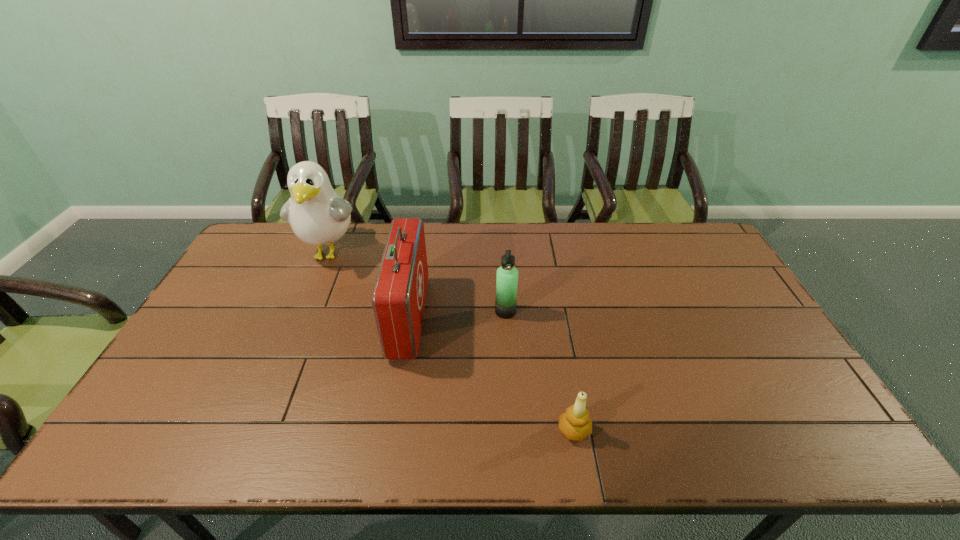
Identify the location of the tallest object. This screenshot has width=960, height=540. (318, 215).

This screenshot has width=960, height=540. Identify the location of gull. (318, 215).

Where is `the second object from left to right`? This screenshot has width=960, height=540. the second object from left to right is located at coordinates (398, 299).

Identify the location of the second tallest object. (398, 299).

The image size is (960, 540). Identify the location of the third tallest object. (507, 275).

This screenshot has height=540, width=960. Find the location of `thermos bottle`. thermos bottle is located at coordinates (507, 275).

The image size is (960, 540). Find the location of `candle_holder`. candle_holder is located at coordinates click(575, 423).

At what (x,y) coordinates should I click in order to perform the action: click on the shortest object. Please return your answer as a coordinate pair (x, y). Looking at the image, I should click on (575, 423).

Where is `free location located 0.260m on the beak of the leftmost object`? free location located 0.260m on the beak of the leftmost object is located at coordinates (294, 340).

Where is `vacant region located 0.390m on the side of the first-aid kit with the first aid cross symbol`? The image size is (960, 540). vacant region located 0.390m on the side of the first-aid kit with the first aid cross symbol is located at coordinates (555, 318).